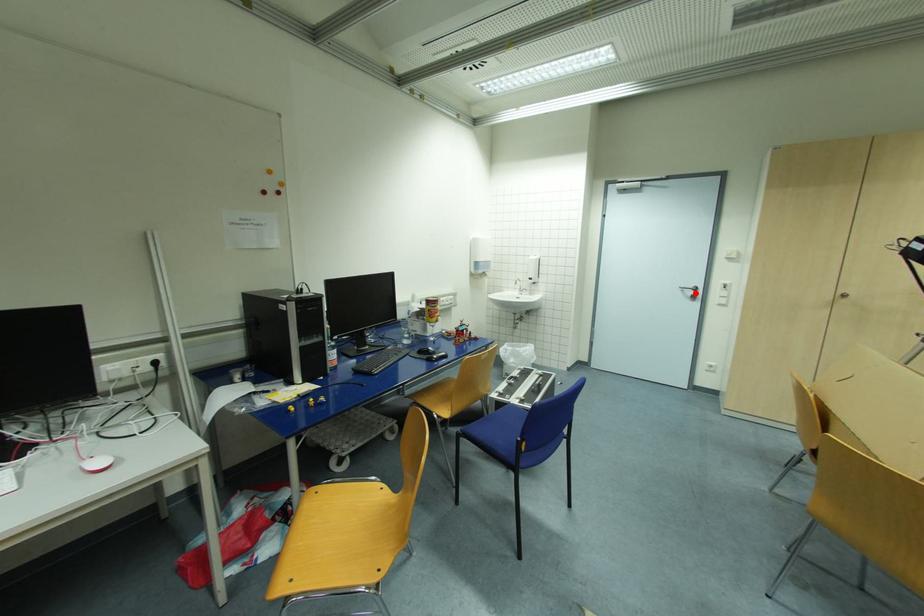
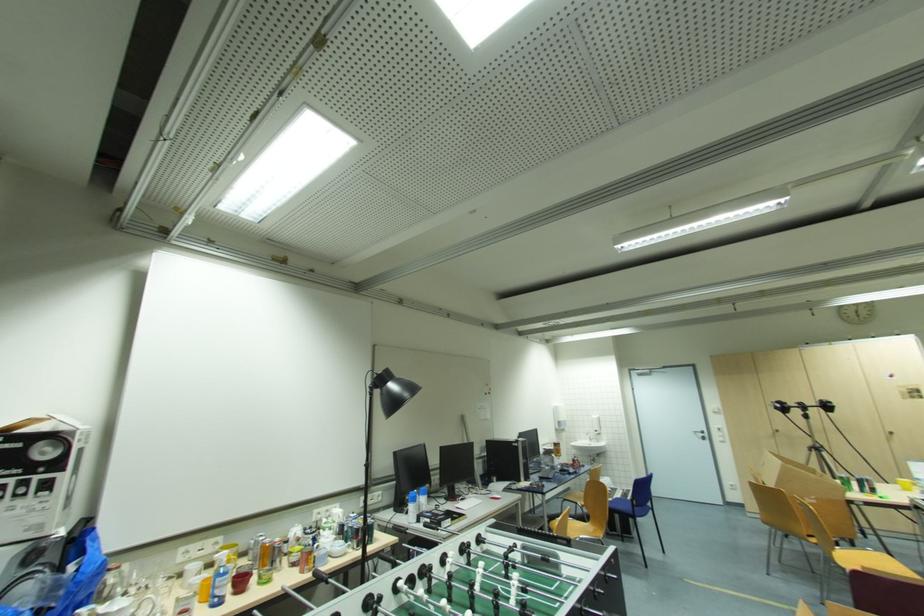
In the second image, find the point that corresponds to the highlighted location in the first image.

(706, 436)